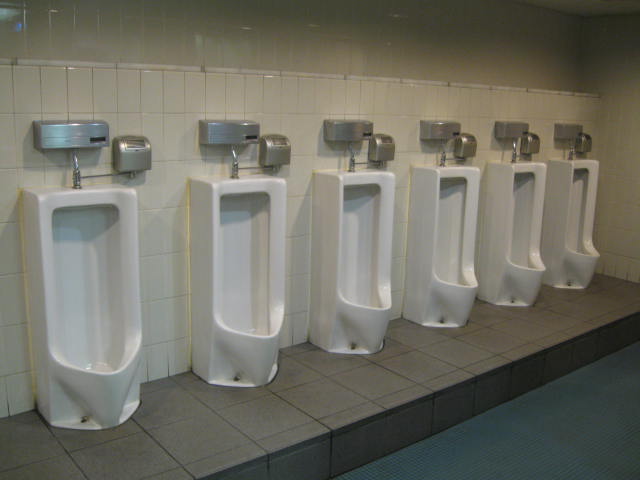
Find the location of a particular element. The height and width of the screenshot is (480, 640). first 5 urinals from the right is located at coordinates (582, 219), (527, 223), (460, 237), (386, 254), (276, 278).